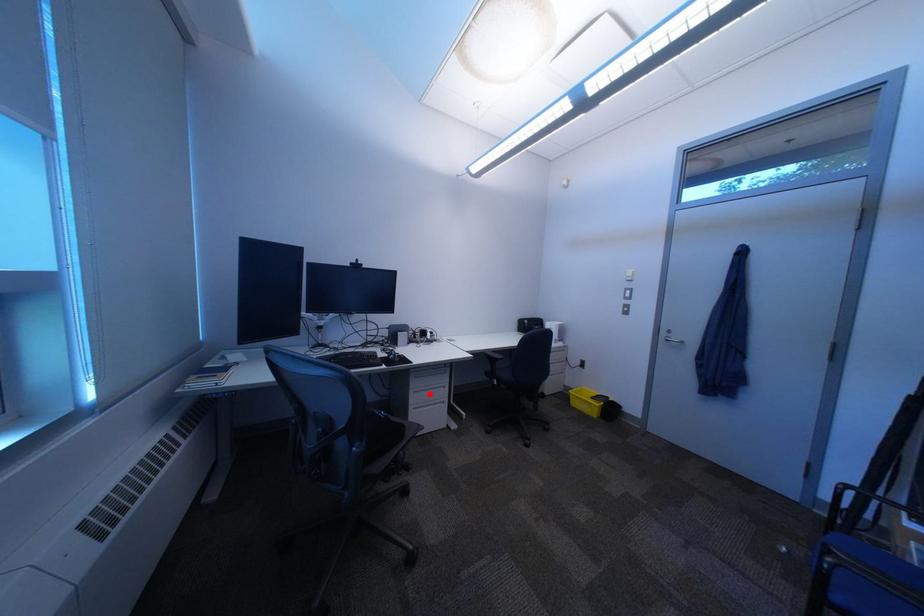
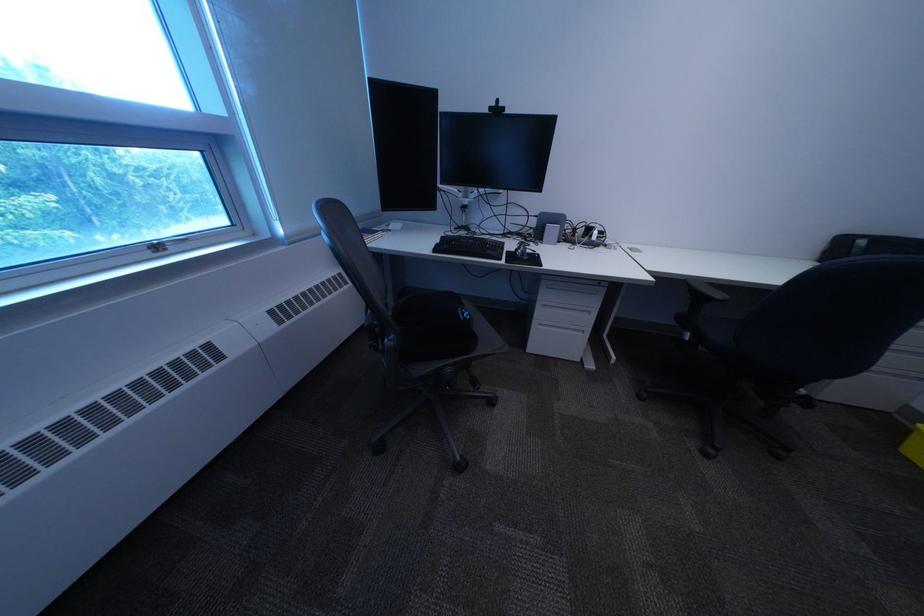
Question: A red point is marked in image1. In image2, is the corresponding 3D point closer to the camera or farther? Reply with the corresponding letter.

Choices:
 (A) The corresponding 3D point is closer.
 (B) The corresponding 3D point is farther.

Answer: (A)